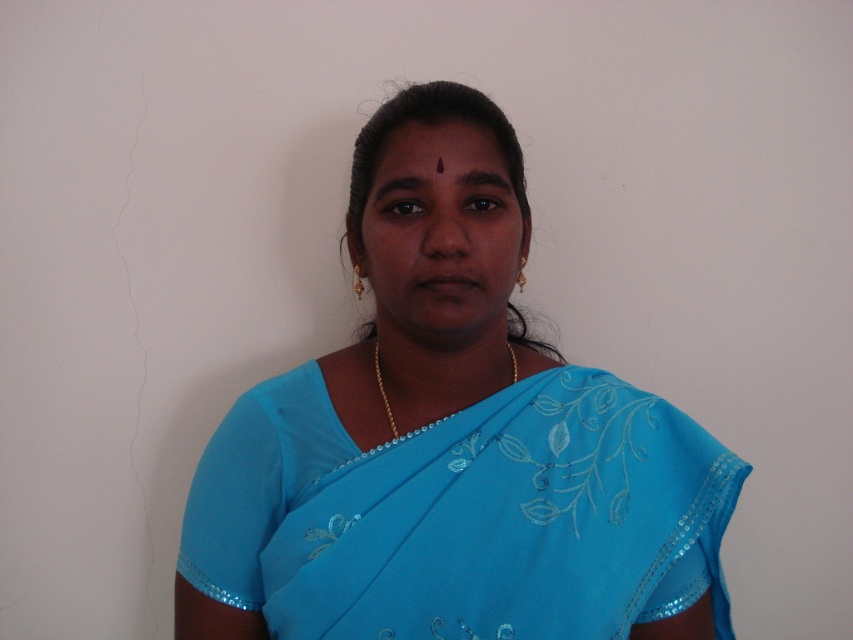
Question: Is blue satin saree at center further to camera compared to gold chain at center?

Choices:
 (A) no
 (B) yes

Answer: (A)

Question: Considering the real-world distances, which object is farthest from the gold chain at center?

Choices:
 (A) blue satin saree at center
 (B) blue silk saree at center

Answer: (A)

Question: Is blue silk saree at center wider than blue satin saree at center?

Choices:
 (A) yes
 (B) no

Answer: (A)

Question: Is blue silk saree at center to the right of blue satin saree at center from the viewer's perspective?

Choices:
 (A) no
 (B) yes

Answer: (B)

Question: Among these objects, which one is farthest from the camera?

Choices:
 (A) blue satin saree at center
 (B) blue silk saree at center

Answer: (B)

Question: Which is farther from the blue satin saree at center?

Choices:
 (A) gold chain at center
 (B) blue silk saree at center

Answer: (A)